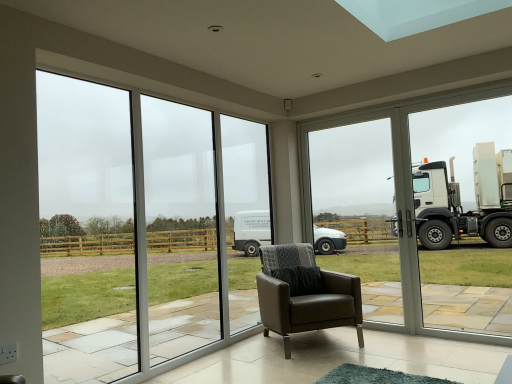
In order to face brown leather armchair at center, should I rotate leftwards or rightwards?

To align with it, rotate right about 6.209°.

Measure the distance between clear glass window at right and camera.

clear glass window at right and camera are 20.11 feet apart from each other.

This screenshot has width=512, height=384. Describe the element at coordinates (138, 227) in the screenshot. I see `transparent glass window at left` at that location.

Where is `brown leather armchair at center`? Image resolution: width=512 pixels, height=384 pixels. brown leather armchair at center is located at coordinates point(305,294).

From the image's perspective, is transparent glass door at center beneath clear glass window at right?

Incorrect, from the image's perspective, transparent glass door at center is higher than clear glass window at right.

Considering the points (337, 206) and (490, 153), which point is behind, point (337, 206) or point (490, 153)?

The point (337, 206) is farther from the camera.

The height and width of the screenshot is (384, 512). In order to click on window screen located above the clear glass window at right (from the image's perspective) in this screenshot , I will do `click(351, 170)`.

Considering the positions of objects transparent glass window at left and transparent glass door at center in the image provided, who is more to the right, transparent glass window at left or transparent glass door at center?

From the viewer's perspective, transparent glass door at center appears more on the right side.

From the picture: Is transparent glass window at left oriented away from transparent glass door at center?

No.

Locate an element on the screen. Image resolution: width=512 pixels, height=384 pixels. window in front of the transparent glass door at center is located at coordinates (138, 227).

In the scene shown: From the image's perspective, is transparent glass window at left on top of transparent glass door at center?

Indeed, from the image's perspective, transparent glass window at left is shown above transparent glass door at center.

How different are the orientations of brown leather armchair at center and clear glass window at right in degrees?

The angle between the facing direction of brown leather armchair at center and the facing direction of clear glass window at right is 52.4 degrees.

Based on the photo, which is nearer, (295, 255) or (373, 123)?

The point (295, 255) is in front.

Does brown leather armchair at center appear on the left side of clear glass window at right?

Indeed, brown leather armchair at center is positioned on the left side of clear glass window at right.

What are the coordinates of `chair lying below the clear glass window at right (from the image's perspective)` in the screenshot? It's located at (305, 294).

From the image's perspective, between clear glass window at right and transparent glass door at center, who is located below?

clear glass window at right, from the image's perspective.

Between clear glass window at right and transparent glass door at center, which one appears on the left side from the viewer's perspective?

Positioned to the left is transparent glass door at center.

Choose the correct answer: Is clear glass window at right inside transparent glass door at center or outside it?

The correct answer is: inside.

From the image's perspective, is clear glass window at right beneath brown leather armchair at center?

No.

Which is correct: clear glass window at right is inside brown leather armchair at center, or outside of it?

clear glass window at right lies outside brown leather armchair at center.

Considering the sizes of clear glass window at right and brown leather armchair at center in the image, is clear glass window at right wider or thinner than brown leather armchair at center?

clear glass window at right is thinner than brown leather armchair at center.

What's the angular difference between clear glass window at right and brown leather armchair at center's facing directions?

There is a 52.4-degree angle between the facing directions of clear glass window at right and brown leather armchair at center.

From the image's perspective, is transparent glass door at center on top of transparent glass window at left?

No, from the image's perspective, transparent glass door at center is not on top of transparent glass window at left.

Between transparent glass door at center and transparent glass window at left, which one has larger size?

transparent glass window at left.

Does transparent glass door at center have a greater height compared to transparent glass window at left?

Incorrect, the height of transparent glass door at center is not larger of that of transparent glass window at left.

In the scene shown: How many degrees apart are the facing directions of transparent glass door at center and transparent glass window at left?

transparent glass door at center and transparent glass window at left are facing 89.4 degrees away from each other.

Between point (115, 116) and point (300, 328), which one is positioned behind?

The point (115, 116) is behind.

From the image's perspective, between transparent glass window at left and brown leather armchair at center, who is located below?

brown leather armchair at center.

Identify the location of chair below the transparent glass window at left (from the image's perspective). (305, 294).

How different are the orientations of transparent glass window at left and brown leather armchair at center in degrees?

37 degrees.

Locate an element on the screen. The width and height of the screenshot is (512, 384). window screen above the clear glass window at right (from the image's perspective) is located at coordinates 351,170.

Find the location of a particular element. window screen that appears on the right of transparent glass window at left is located at coordinates (351, 170).

Looking at the image, which one is located closer to clear glass window at right, transparent glass door at center or brown leather armchair at center?

transparent glass door at center lies closer to clear glass window at right than the other object.

In the scene shown: Looking at the image, which one is located further to transparent glass door at center, transparent glass window at left or clear glass window at right?

transparent glass window at left.

Based on the photo, looking at the image, which one is located closer to transparent glass door at center, brown leather armchair at center or transparent glass window at left?

Based on the image, brown leather armchair at center appears to be nearer to transparent glass door at center.

Estimate the real-world distances between objects in this image. Which object is closer to transparent glass window at left, transparent glass door at center or clear glass window at right?

transparent glass door at center lies closer to transparent glass window at left than the other object.

Looking at this image, looking at the image, which one is located further to brown leather armchair at center, clear glass window at right or transparent glass window at left?

clear glass window at right lies further to brown leather armchair at center than the other object.

From the picture: Based on their spatial positions, is transparent glass window at left or clear glass window at right further from brown leather armchair at center?

Based on the image, clear glass window at right appears to be further to brown leather armchair at center.

From the image, which object appears to be farther from clear glass window at right, transparent glass door at center or transparent glass window at left?

Based on the image, transparent glass window at left appears to be further to clear glass window at right.

When comparing their distances from clear glass window at right, does brown leather armchair at center or transparent glass window at left seem further?

Based on the image, transparent glass window at left appears to be further to clear glass window at right.

At what (x,y) coordinates should I click in order to perform the action: click on window screen between transparent glass window at left and clear glass window at right from left to right. Please return your answer as a coordinate pair (x, y). The image size is (512, 384). Looking at the image, I should click on (351, 170).

Locate an element on the screen. window screen between brown leather armchair at center and clear glass window at right in the horizontal direction is located at coordinates (351, 170).

Where is `chair between transparent glass window at left and transparent glass door at center`? The width and height of the screenshot is (512, 384). chair between transparent glass window at left and transparent glass door at center is located at coordinates (305, 294).

At what (x,y) coordinates should I click in order to perform the action: click on chair located between transparent glass window at left and clear glass window at right in the left-right direction. Please return your answer as a coordinate pair (x, y). Image resolution: width=512 pixels, height=384 pixels. Looking at the image, I should click on (305, 294).